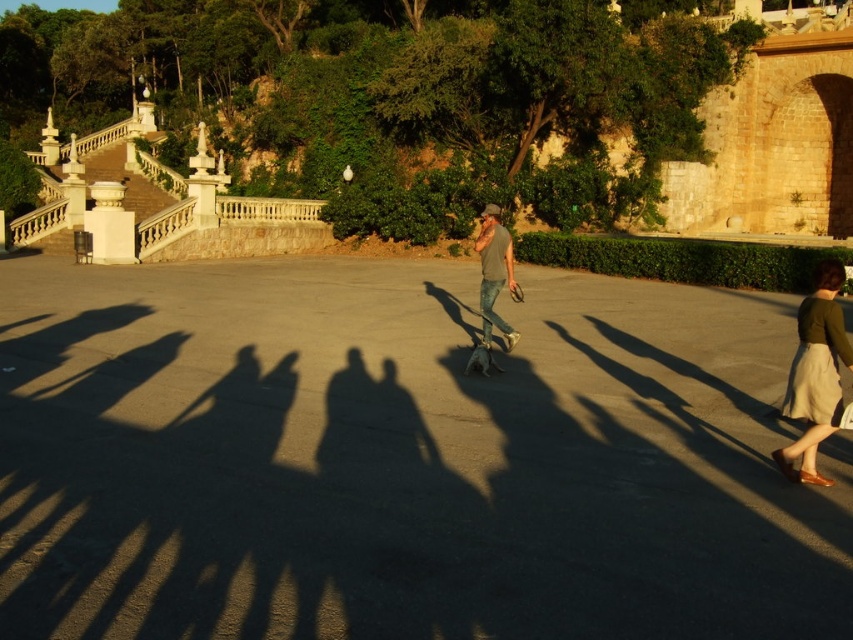
You are an observer standing in the plaza and see the green fabric skirt at right and the matte gray shirt at center. Which object is shorter in height?

The green fabric skirt at right has a lesser height compared to the matte gray shirt at center, so the green fabric skirt at right is shorter in height.

You are standing in the plaza and see the green fabric skirt at right and the matte gray shirt at center. Which object is nearer to you?

The green fabric skirt at right is closer to the viewer than the matte gray shirt at center.